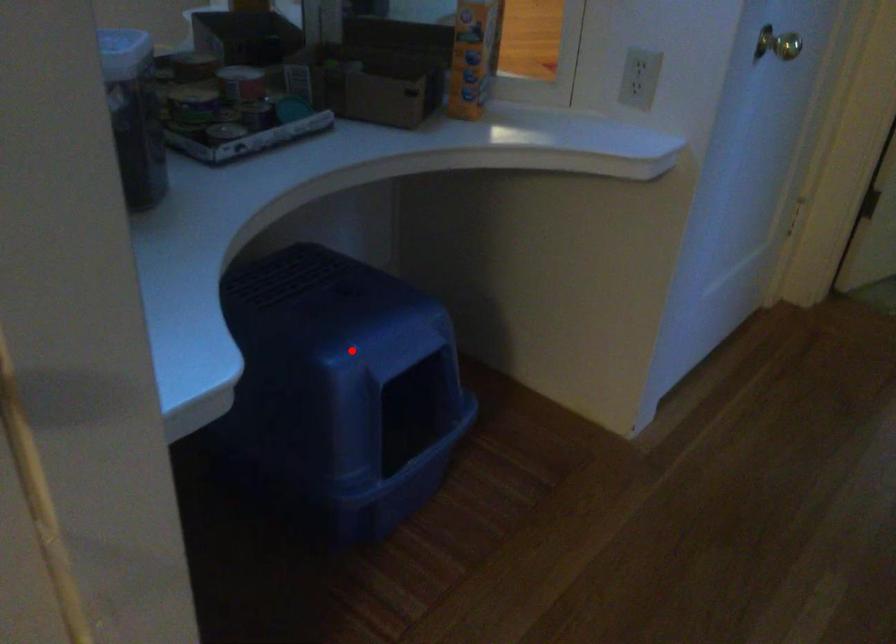
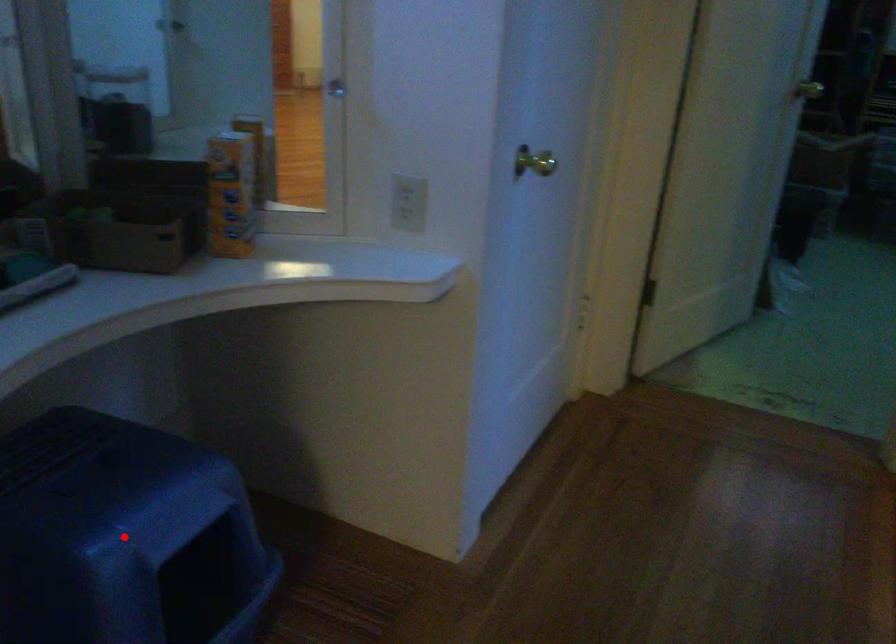
I am providing you with two images of the same scene from different viewpoints. A red point is marked on the first image and another point is marked on the second image. Is the red point in image1 aligned with the point shown in image2?

Yes